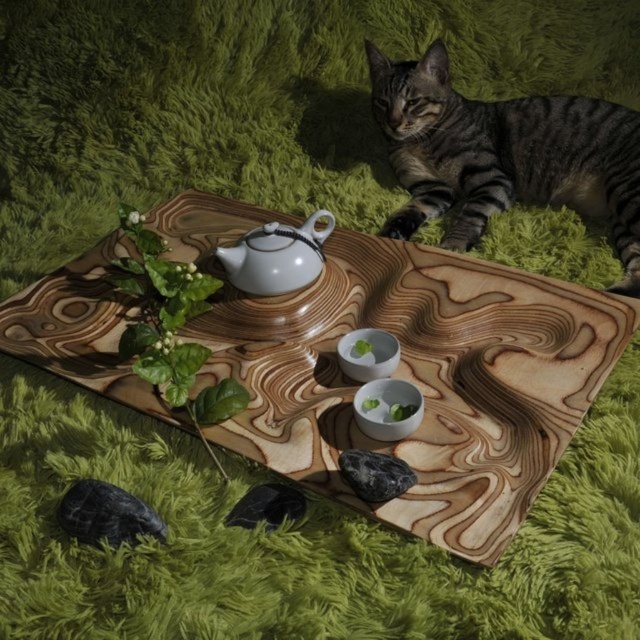
Can you confirm if tabby fur cat at upper right is positioned above white glossy teapot at center?

Yes, tabby fur cat at upper right is above white glossy teapot at center.

How far apart are tabby fur cat at upper right and white glossy teapot at center?

tabby fur cat at upper right is 16.99 inches from white glossy teapot at center.

I want to click on tabby fur cat at upper right, so click(x=504, y=156).

Who is more forward, (243,288) or (397,358)?

Point (397,358) is more forward.

Who is positioned more to the right, white glossy teapot at center or white glossy bowls at center?

Positioned to the right is white glossy bowls at center.

You are a GUI agent. You are given a task and a screenshot of the screen. Output one action in this format:
    pyautogui.click(x=<x>, y=<y>)
    Task: Click on the white glossy teapot at center
    This screenshot has width=640, height=640.
    Given the screenshot: What is the action you would take?
    pyautogui.click(x=276, y=257)

Consider the image. Which is below, wooden tray at center or white glossy bowls at center?

white glossy bowls at center is below.

Who is more forward, (x=576, y=307) or (x=397, y=397)?

Positioned in front is point (x=397, y=397).

Which is behind, point (417, 253) or point (346, 369)?

Positioned behind is point (417, 253).

I want to click on wooden tray at center, so click(420, 380).